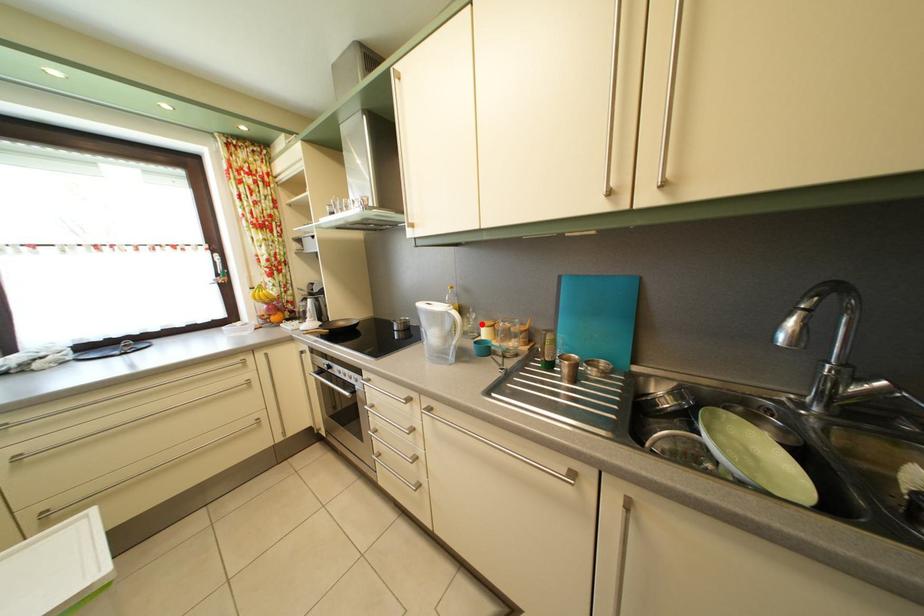
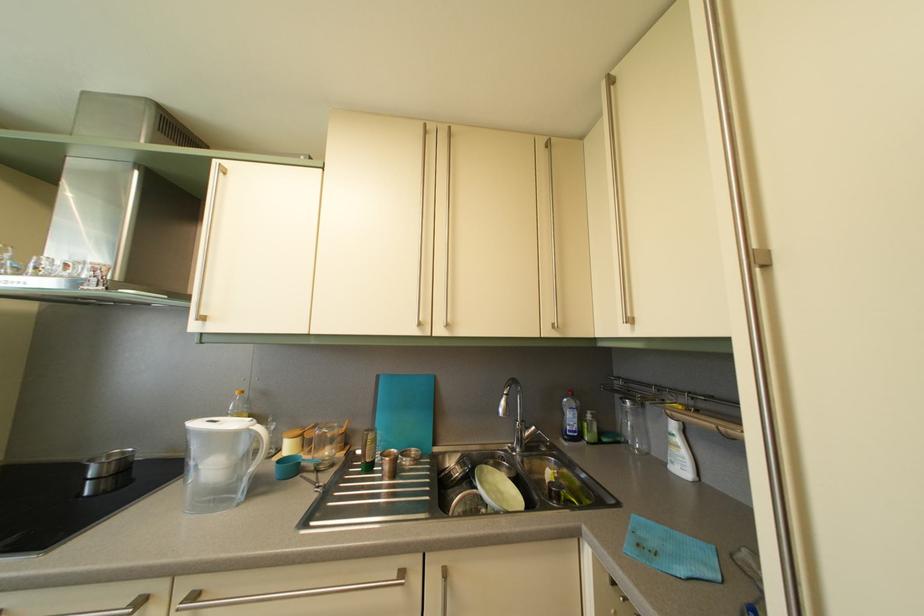
The point at the highlighted location is marked in the first image. Where is the corresponding point in the second image?

(282, 435)